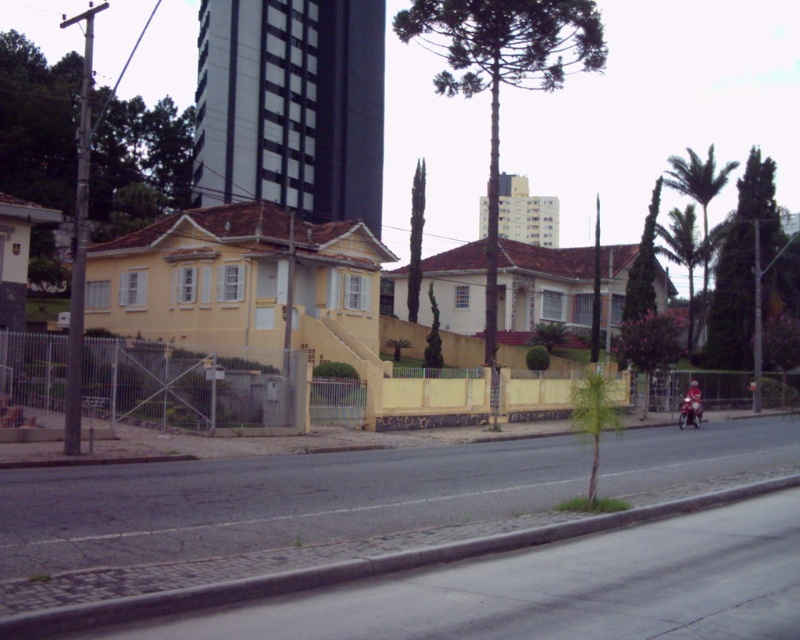
Who is positioned more to the left, metallic silver motorcycle at center or shiny red motorcycle at center-right?

From the viewer's perspective, shiny red motorcycle at center-right appears more on the left side.

Who is shorter, metallic silver motorcycle at center or shiny red motorcycle at center-right?

shiny red motorcycle at center-right

Looking at this image, who is more distant from viewer, (686,413) or (688,417)?

Point (686,413)

This screenshot has height=640, width=800. Find the location of `metallic silver motorcycle at center`. metallic silver motorcycle at center is located at coordinates (690, 406).